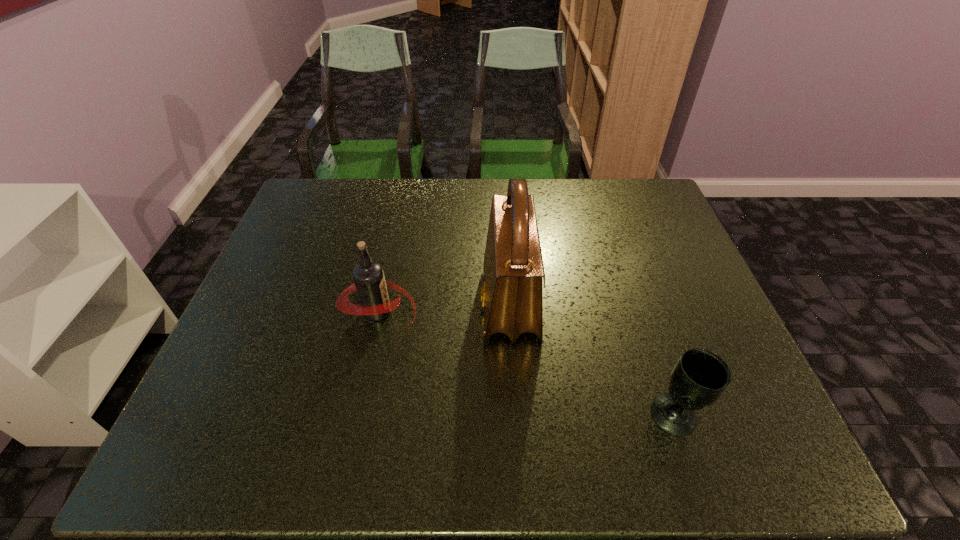
At what (x,y) coordinates should I click in order to perform the action: click on the tallest object. Please return your answer as a coordinate pair (x, y). Looking at the image, I should click on (512, 295).

Locate an element on the screen. Image resolution: width=960 pixels, height=540 pixels. the second object from left to right is located at coordinates (512, 295).

Find the location of a particular element. the leftmost object is located at coordinates (369, 281).

Where is `the second shortest object`? Image resolution: width=960 pixels, height=540 pixels. the second shortest object is located at coordinates (369, 281).

The width and height of the screenshot is (960, 540). In order to click on the rightmost object in this screenshot , I will do `click(699, 378)`.

Where is `chalice`? chalice is located at coordinates (699, 378).

At what (x,y) coordinates should I click in order to perform the action: click on vacant space located on the front flap of the tallest object. Please return your answer as a coordinate pair (x, y). Image resolution: width=960 pixels, height=540 pixels. Looking at the image, I should click on (348, 305).

Where is `free location located 0.280m on the front flap of the tallest object`? The height and width of the screenshot is (540, 960). free location located 0.280m on the front flap of the tallest object is located at coordinates (371, 305).

Locate an element on the screen. This screenshot has width=960, height=540. free space located on the front flap of the tallest object is located at coordinates (339, 305).

Where is `vacant space located 0.360m on the label of the leftmost object`? This screenshot has width=960, height=540. vacant space located 0.360m on the label of the leftmost object is located at coordinates (561, 311).